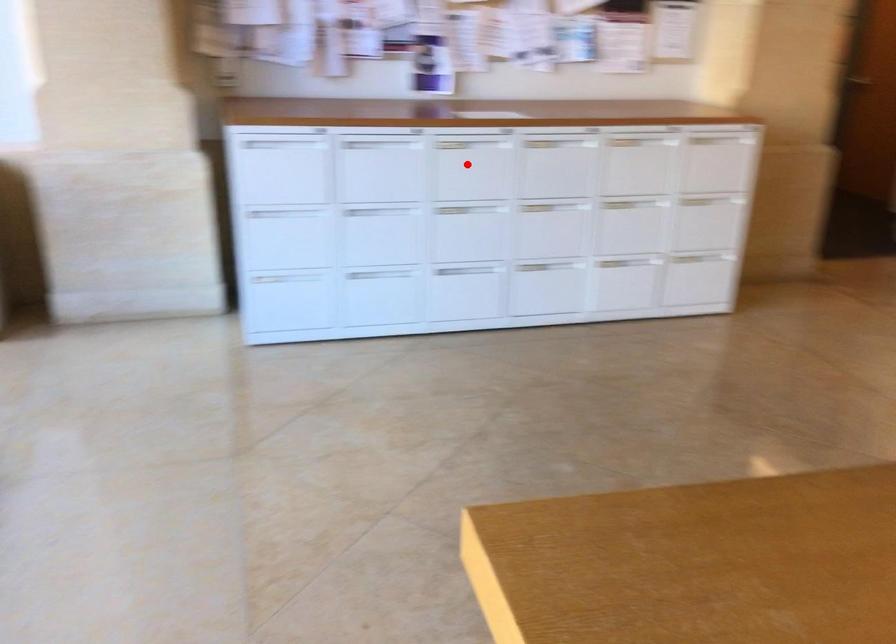
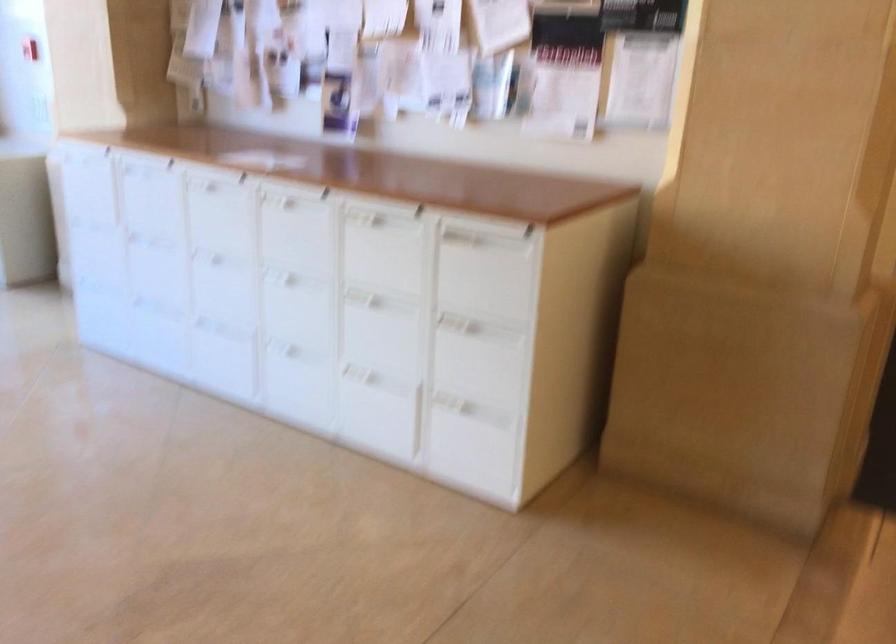
Question: I am providing you with two images of the same scene from different viewpoints. Given a red point in image1, look at the same physical point in image2. Is it:

Choices:
 (A) Closer to the viewpoint
 (B) Farther from the viewpoint

Answer: (A)